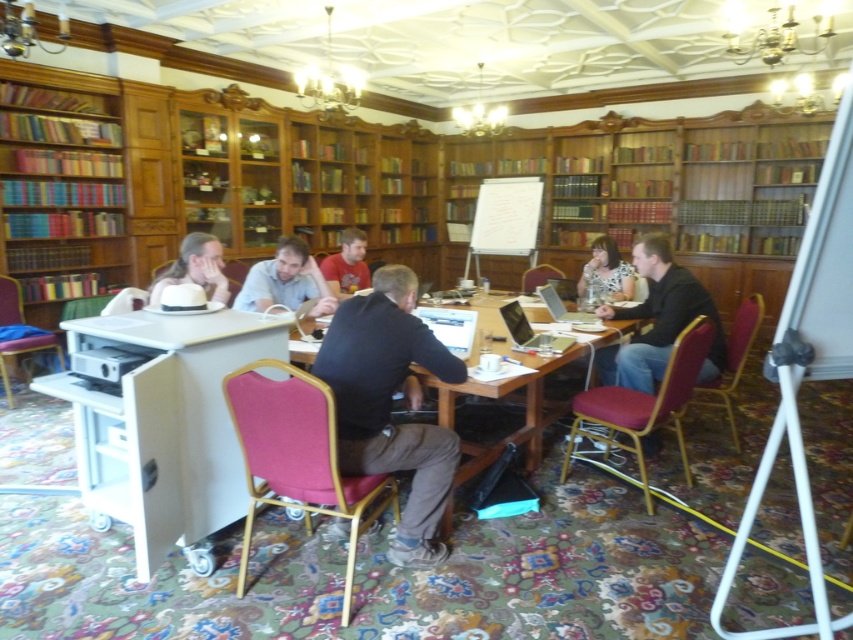
Question: Which of the following is the farthest from the observer?

Choices:
 (A) wooden bookshelf at left
 (B) black shirt at center
 (C) black matte shirt at center

Answer: (A)

Question: Estimate the real-world distances between objects in this image. Which object is closer to the wooden table at center?

Choices:
 (A) matte white hat at center
 (B) matte red shirt at center
 (C) light blue shirt at center

Answer: (C)

Question: Does black shirt at center lie behind matte white hat at center?

Choices:
 (A) no
 (B) yes

Answer: (B)

Question: Which of the following is the closest to the observer?

Choices:
 (A) light blue shirt at center
 (B) black shirt at center
 (C) black matte shirt at center

Answer: (C)

Question: Is matte white hat at center positioned at the back of matte red shirt at center?

Choices:
 (A) no
 (B) yes

Answer: (A)

Question: Does wooden table at center appear on the right side of matte white hat at center?

Choices:
 (A) yes
 (B) no

Answer: (A)